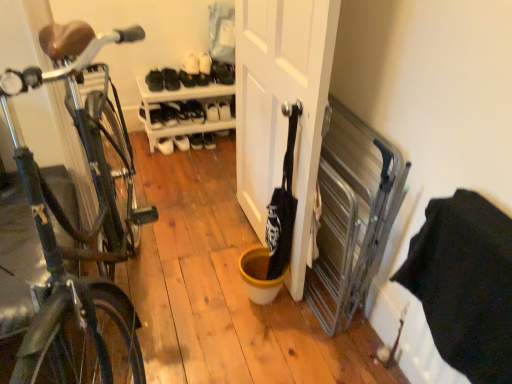
Locate an element on the screen. The width and height of the screenshot is (512, 384). black leather shoe at upper center, which is the sixth shoe from left to right is located at coordinates (223, 73).

Image resolution: width=512 pixels, height=384 pixels. What do you see at coordinates (208, 141) in the screenshot? I see `white leather shoe at center` at bounding box center [208, 141].

The image size is (512, 384). Describe the element at coordinates (259, 275) in the screenshot. I see `yellow matte bucket at center` at that location.

The height and width of the screenshot is (384, 512). Identify the location of black leather shoe at upper center, the second shoe viewed from the right. (223, 73).

Is white fabric shoe at upper center, which is the third shoe from left to right, positioned with its back to white plastic shoe rack at center?

white fabric shoe at upper center, which is the third shoe from left to right, is not turned away from white plastic shoe rack at center.

Is the depth of white fabric shoe at upper center, marked as the 5th shoe in a right-to-left arrangement, less than that of white plastic shoe rack at center?

That is False.

Which point is more distant from viewer, (191,59) or (168,135)?

The point (168,135) is farther.

Who is smaller, white fabric shoe at upper center, which is the third shoe from left to right, or white plastic shoe rack at center?

With smaller size is white fabric shoe at upper center, which is the third shoe from left to right.

Looking at their sizes, would you say white leather shoe at center, positioned as the first shoe in left-to-right order, is wider or thinner than white plastic shoe rack at center?

Clearly, white leather shoe at center, positioned as the first shoe in left-to-right order, has less width compared to white plastic shoe rack at center.

Are white leather shoe at center, which appears as the 7th shoe when viewed from the right, and white plastic shoe rack at center located far from each other?

Actually, white leather shoe at center, which appears as the 7th shoe when viewed from the right, and white plastic shoe rack at center are a little close together.

Is white leather shoe at center, which appears as the 7th shoe when viewed from the right, aimed at white plastic shoe rack at center?

Yes, white leather shoe at center, which appears as the 7th shoe when viewed from the right, is oriented towards white plastic shoe rack at center.

Considering the relative sizes of yellow matte bucket at center and white matte sneakers at upper center in the image provided, is yellow matte bucket at center wider than white matte sneakers at upper center?

Incorrect, the width of yellow matte bucket at center does not surpass that of white matte sneakers at upper center.

Which is more to the right, yellow matte bucket at center or white matte sneakers at upper center?

From the viewer's perspective, yellow matte bucket at center appears more on the right side.

Is point (254, 259) less distant than point (178, 87)?

Yes, point (254, 259) is closer to viewer.

From the image's perspective, is yellow matte bucket at center under white matte sneakers at upper center?

Yes, from the image's perspective, yellow matte bucket at center is below white matte sneakers at upper center.

Which object is more forward, black leather shoe at upper center, the 2th shoe when ordered from left to right, or white matte shoe at upper center, marked as the seventh shoe in a left-to-right arrangement?

black leather shoe at upper center, the 2th shoe when ordered from left to right, is in front.

Is black leather shoe at upper center, the 2th shoe when ordered from left to right, not within white matte shoe at upper center, marked as the seventh shoe in a left-to-right arrangement?

Yes, black leather shoe at upper center, the 2th shoe when ordered from left to right, is located beyond the bounds of white matte shoe at upper center, marked as the seventh shoe in a left-to-right arrangement.

From a real-world perspective, who is located lower, black leather shoe at upper center, positioned as the 6th shoe in right-to-left order, or white matte shoe at upper center, marked as the seventh shoe in a left-to-right arrangement?

In real-world perspective, white matte shoe at upper center, marked as the seventh shoe in a left-to-right arrangement, is lower.

Can you see black leather shoe at upper center, positioned as the 6th shoe in right-to-left order, touching white matte shoe at upper center, the first shoe viewed from the right?

black leather shoe at upper center, positioned as the 6th shoe in right-to-left order, and white matte shoe at upper center, the first shoe viewed from the right, are clearly separated.

Does white matte sneakers at upper center have a larger size compared to white leather shoe at center?

Indeed, white matte sneakers at upper center has a larger size compared to white leather shoe at center.

Considering the relative sizes of white matte sneakers at upper center and white leather shoe at center in the image provided, is white matte sneakers at upper center shorter than white leather shoe at center?

No, white matte sneakers at upper center is not shorter than white leather shoe at center.

Is the depth of white matte sneakers at upper center greater than that of white leather shoe at center?

No, white matte sneakers at upper center is closer to the viewer.

Consider the image. From a real-world perspective, relative to white matte sneakers at upper center, is shiny black bicycle at left vertically above or below?

From a real-world perspective, shiny black bicycle at left is physically above white matte sneakers at upper center.

How much distance is there between shiny black bicycle at left and white matte sneakers at upper center?

A distance of 1.28 meters exists between shiny black bicycle at left and white matte sneakers at upper center.

Is shiny black bicycle at left not near white matte sneakers at upper center?

shiny black bicycle at left is far away from white matte sneakers at upper center.

Based on the photo, which object is wider, shiny black bicycle at left or white matte sneakers at upper center?

With larger width is shiny black bicycle at left.

Considering the sizes of objects white leather shoe at center and white matte sneakers at upper center in the image provided, who is bigger, white leather shoe at center or white matte sneakers at upper center?

white matte sneakers at upper center.

From the image's perspective, is white leather shoe at center located above white matte sneakers at upper center?

No, from the image's perspective, white leather shoe at center is not above white matte sneakers at upper center.

Which of these two, white leather shoe at center or white matte sneakers at upper center, is thinner?

With smaller width is white leather shoe at center.

This screenshot has width=512, height=384. Identify the location of the 2nd shoe to the right of the white plastic shoe rack at center, counting from the anchor's position. (190, 63).

Locate an element on the screen. Image resolution: width=512 pixels, height=384 pixels. shoe lying below the white plastic shoe rack at center (from the image's perspective) is located at coordinates (156, 118).

Looking at the image, which one is located further to white fabric shoe at upper center, which is the third shoe from left to right, yellow matte bucket at center or white leather shoe at center, which appears as the 7th shoe when viewed from the right?

yellow matte bucket at center is positioned further to the anchor white fabric shoe at upper center, which is the third shoe from left to right.

Looking at the image, which one is located closer to white matte shoe at upper center, the first shoe viewed from the right, shiny black bicycle at left or white leather shoe at center?

The object closer to white matte shoe at upper center, the first shoe viewed from the right, is white leather shoe at center.

From the picture: When comparing their distances from white matte shoe at upper center, marked as the seventh shoe in a left-to-right arrangement, does white matte sneakers at upper center or white leather shoe at center seem closer?

white leather shoe at center.

Which object lies nearer to the anchor point white matte shoe at upper center, which ranks as the fifth shoe in left-to-right order, white plastic shoe rack at center or shiny black bicycle at left?

white plastic shoe rack at center is positioned closer to the anchor white matte shoe at upper center, which ranks as the fifth shoe in left-to-right order.

When comparing their distances from white fabric shoe at upper center, which is the third shoe from left to right, does white matte door at center or shiny black bicycle at left seem further?

The object further to white fabric shoe at upper center, which is the third shoe from left to right, is shiny black bicycle at left.

When comparing their distances from white matte sneakers at upper center, does shiny black bicycle at left or white leather shoe at center, which appears as the 7th shoe when viewed from the right, seem closer?

white leather shoe at center, which appears as the 7th shoe when viewed from the right, is closer to white matte sneakers at upper center.

Estimate the real-world distances between objects in this image. Which object is further from black leather shoe at upper center, which is the sixth shoe from left to right, white matte shoe at upper center, the first shoe viewed from the right, or white matte shoe at upper center, the 4th shoe positioned from the right?

white matte shoe at upper center, the 4th shoe positioned from the right, lies further to black leather shoe at upper center, which is the sixth shoe from left to right, than the other object.

When comparing their distances from white leather shoe at center, positioned as the first shoe in left-to-right order, does shiny black bicycle at left or black leather shoe at upper center, positioned as the 6th shoe in right-to-left order, seem closer?

black leather shoe at upper center, positioned as the 6th shoe in right-to-left order, lies closer to white leather shoe at center, positioned as the first shoe in left-to-right order, than the other object.

Identify the location of sneakers between shiny black bicycle at left and white matte shoe at upper center, the 4th shoe positioned from the right, from front to back. click(x=170, y=79).

I want to click on bucket positioned between shiny black bicycle at left and white plastic shoe rack at center from near to far, so click(x=259, y=275).

Locate an element on the screen. The height and width of the screenshot is (384, 512). shelf between white leather shoe at center, which appears as the 7th shoe when viewed from the right, and white matte shoe at upper center, the fourth shoe from the left, in the horizontal direction is located at coordinates (176, 100).

Locate an element on the screen. sneakers between black leather shoe at upper center, positioned as the 6th shoe in right-to-left order, and white leather shoe at center, positioned as the first shoe in left-to-right order, in the up-down direction is located at coordinates (170, 79).